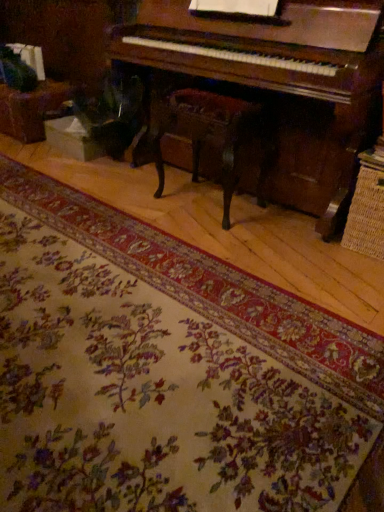
Question: Is wooden polished chair at center inside floral carpet at center?

Choices:
 (A) no
 (B) yes

Answer: (A)

Question: Considering the relative sizes of floral carpet at center and wooden polished chair at center in the image provided, is floral carpet at center bigger than wooden polished chair at center?

Choices:
 (A) no
 (B) yes

Answer: (B)

Question: Considering the relative sizes of floral carpet at center and wooden polished chair at center in the image provided, is floral carpet at center smaller than wooden polished chair at center?

Choices:
 (A) yes
 (B) no

Answer: (B)

Question: Is floral carpet at center not near wooden polished chair at center?

Choices:
 (A) no
 (B) yes

Answer: (A)

Question: From a real-world perspective, is floral carpet at center on top of wooden polished chair at center?

Choices:
 (A) no
 (B) yes

Answer: (A)

Question: Is floral carpet at center closer to the viewer compared to wooden polished chair at center?

Choices:
 (A) yes
 (B) no

Answer: (A)

Question: Considering the relative sizes of wooden polished chair at center and floral carpet at center in the image provided, is wooden polished chair at center thinner than floral carpet at center?

Choices:
 (A) no
 (B) yes

Answer: (B)

Question: Does wooden polished chair at center come behind floral carpet at center?

Choices:
 (A) no
 (B) yes

Answer: (B)

Question: Is wooden polished chair at center wider than floral carpet at center?

Choices:
 (A) yes
 (B) no

Answer: (B)

Question: Considering the relative sizes of wooden polished chair at center and floral carpet at center in the image provided, is wooden polished chair at center smaller than floral carpet at center?

Choices:
 (A) no
 (B) yes

Answer: (B)

Question: From the image's perspective, is wooden polished chair at center located beneath floral carpet at center?

Choices:
 (A) no
 (B) yes

Answer: (A)

Question: From a real-world perspective, does wooden polished chair at center stand above floral carpet at center?

Choices:
 (A) no
 (B) yes

Answer: (B)

Question: Considering the positions of floral carpet at center and wooden polished chair at center in the image, is floral carpet at center bigger or smaller than wooden polished chair at center?

Choices:
 (A) big
 (B) small

Answer: (A)